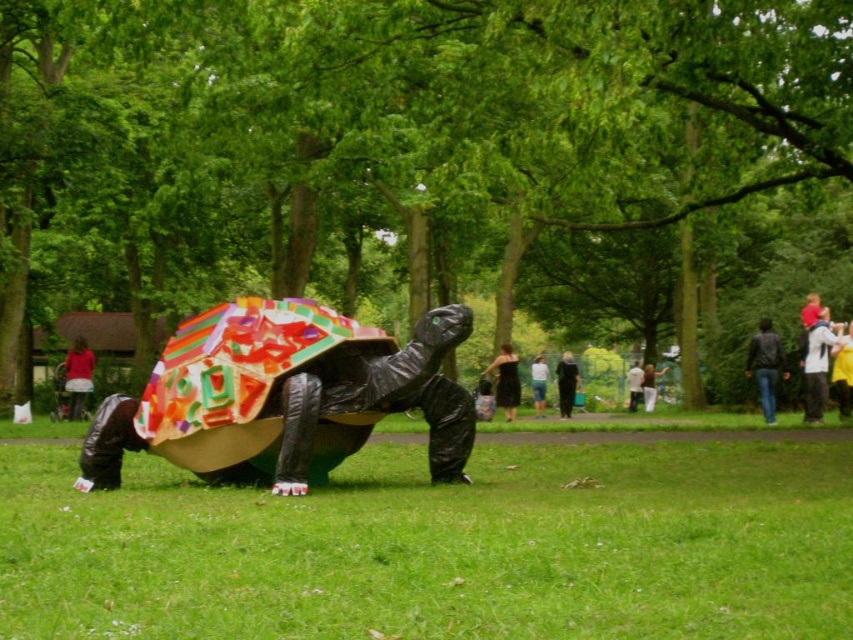
Consider the image. You are a photographer setting up a tripod to take a picture of the turtle sculpture. You notice a leather jacket at right and a yellow fabric at lower right in your frame. Which object is taller in the scene?

The leather jacket at right is taller than the yellow fabric at lower right.

You are standing in the park and see the green grass at lower center and the denim jacket at center. Which object is closer to your left side?

The green grass at lower center is closer to your left side because it is positioned to the left of the denim jacket at center.

You are standing in the park and want to place a small picnic basket on the green grass at lower center. According to the coordinates provided, where exactly should you place it?

The green grass at lower center is located at point (445, 545), so you should place the picnic basket there.